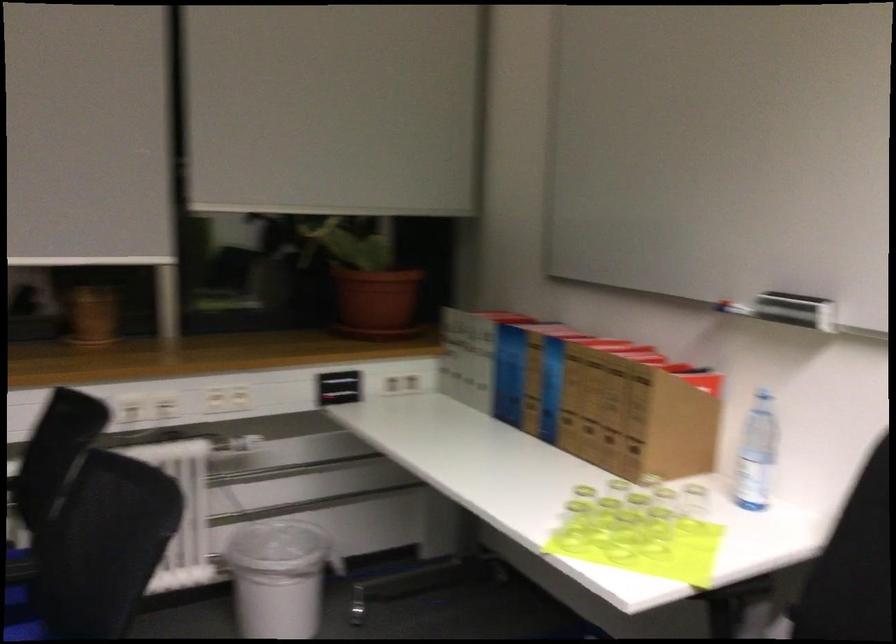
The location [634,417] corresponds to which object?

It corresponds to the cardboard file holder in the image.